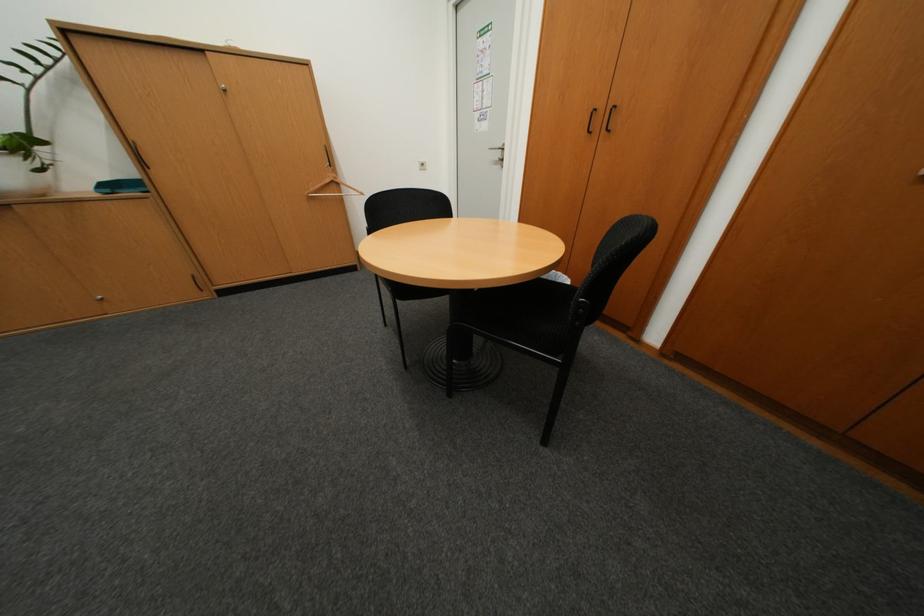
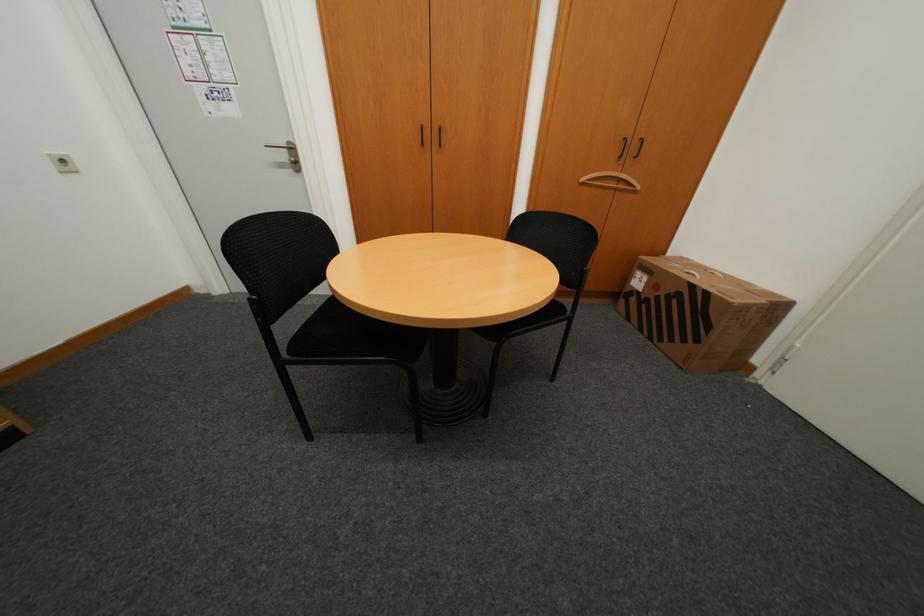
Question: The camera is either moving clockwise (left) or counter-clockwise (right) around the object. The first image is from the beginning of the video and the second image is from the end. Is the camera moving left or right when shooting the video?

Choices:
 (A) Left
 (B) Right

Answer: (A)